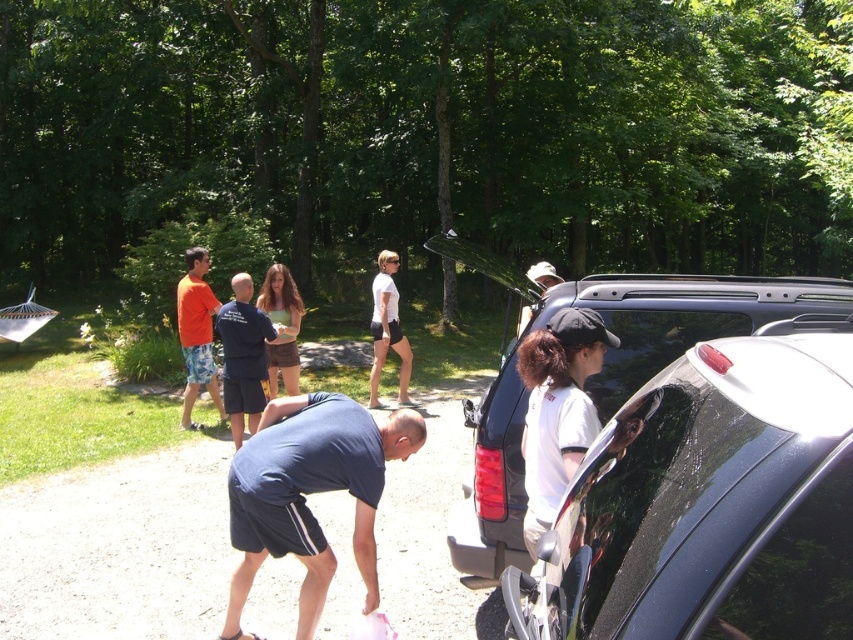
You are a photographer standing at the edge of the dirt path in the park. You want to take a photo that includes both the dark blue fabric shirt at lower center and the white matte shirt at right. Based on their positions, which shirt should you frame first in your camera viewfinder to ensure both are in the shot?

The dark blue fabric shirt at lower center is positioned on the left side of white matte shirt at right. Therefore, you should frame the dark blue fabric shirt at lower center first, then adjust to include the white matte shirt at right in the shot.

You are a photographer standing at the edge of the dirt path in the park. You want to take a photo of both the dark blue fabric shirt at lower center and the white matte shirt at right in the same frame. Given that your camera has a maximum focus range of 1 meter, will you be able to capture both subjects clearly in one shot?

The distance between the dark blue fabric shirt at lower center and the white matte shirt at right is 92.60 centimeters, which is within the camera maximum focus range of 1 meter. Therefore, both subjects can be captured clearly in one shot.